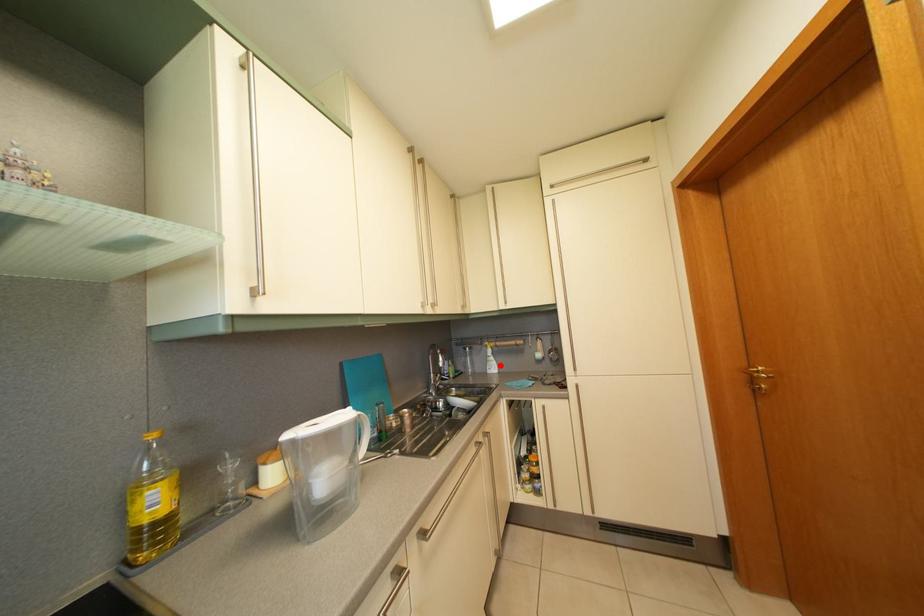
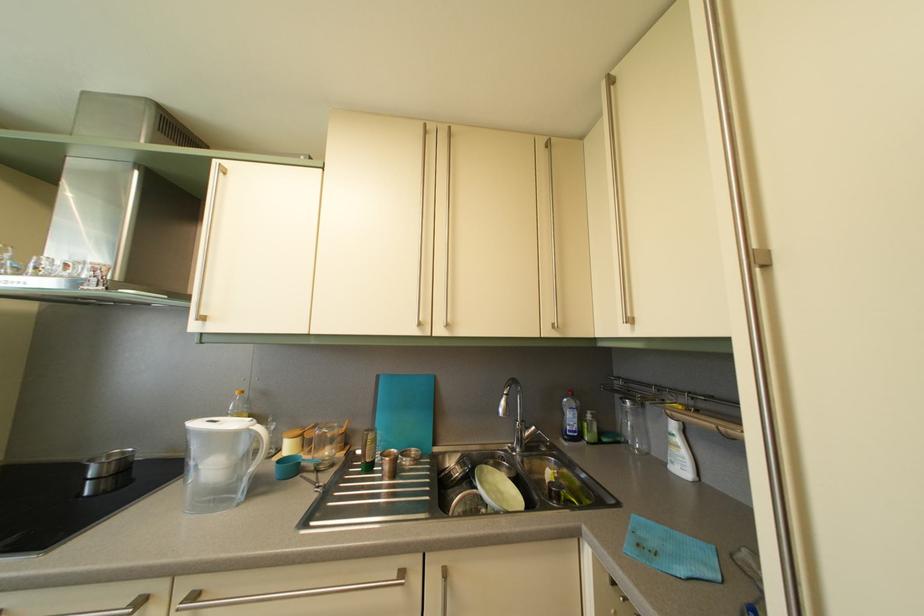
Question: I am providing you with two images of the same scene from different viewpoints. In image1, a red point is highlighted. Considering the same 3D point in image2, which of the following is correct?

Choices:
 (A) It is closer
 (B) It is farther

Answer: (A)